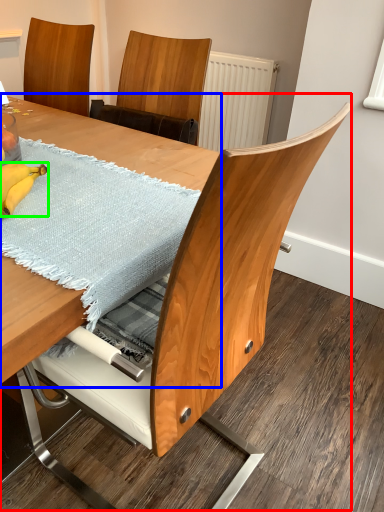
Question: Estimate the real-world distances between objects in this image. Which object is farther from table (highlighted by a red box), table (highlighted by a blue box) or banana (highlighted by a green box)?

Choices:
 (A) table
 (B) banana

Answer: (A)